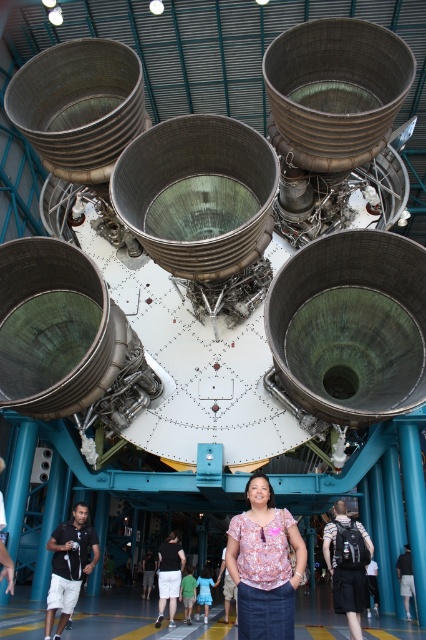
Question: Does pink floral blouse at center lie in front of floral blouse at center?

Choices:
 (A) no
 (B) yes

Answer: (B)

Question: Which object is closer to the camera taking this photo?

Choices:
 (A) pink floral blouse at center
 (B) floral blouse at center

Answer: (A)

Question: Which point appears closest to the camera in this image?

Choices:
 (A) (166, 541)
 (B) (287, 532)

Answer: (B)

Question: Which point is farther from the camera taking this photo?

Choices:
 (A) (282, 621)
 (B) (158, 564)

Answer: (B)

Question: Does pink floral blouse at center have a greater width compared to floral blouse at center?

Choices:
 (A) yes
 (B) no

Answer: (A)

Question: Is pink floral blouse at center to the right of floral blouse at center from the viewer's perspective?

Choices:
 (A) yes
 (B) no

Answer: (A)